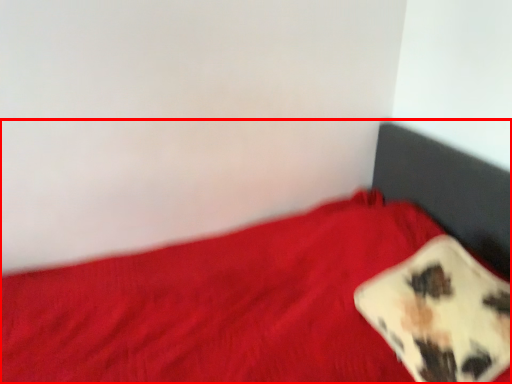
Question: From the image's perspective, what is the correct spatial positioning of bed (annotated by the red box) in reference to pillow?

Choices:
 (A) above
 (B) below

Answer: (B)